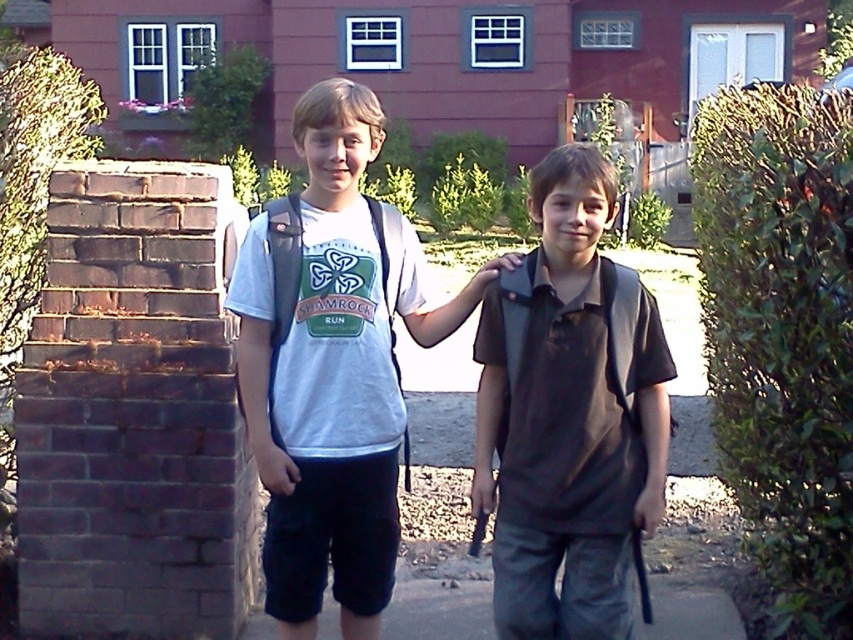
You are a photographer trying to capture a photo of the dark brown shirt at center and the gray concrete pavement at lower center. Which object is positioned higher in the image?

The dark brown shirt at center is located above the gray concrete pavement at lower center, so it is positioned higher in the image.